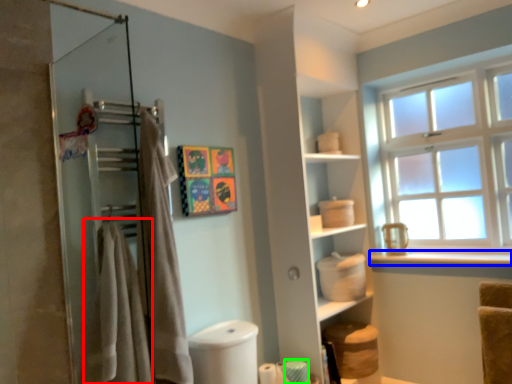
Question: Based on their relative distances, which object is farther from bath towel (highlighted by a red box)? Choose from window sill (highlighted by a blue box) and toilet paper (highlighted by a green box).

Choices:
 (A) window sill
 (B) toilet paper

Answer: (A)